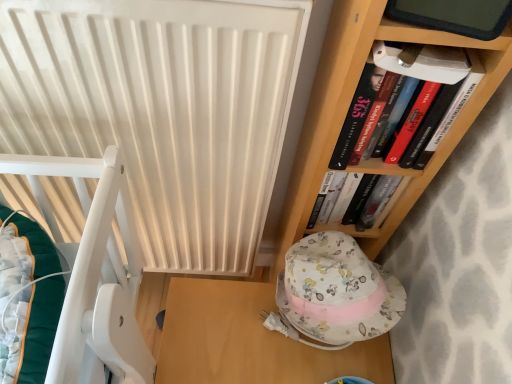
Locate an element on the screen. vacant region to the left of floral fabric hat at lower center is located at coordinates (226, 321).